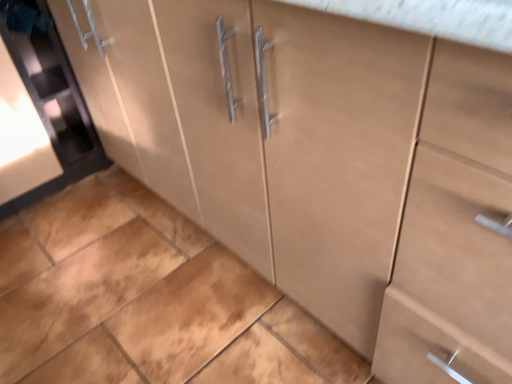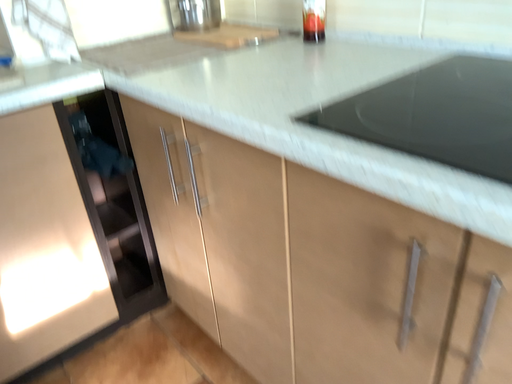
Question: Which way did the camera rotate in the video?

Choices:
 (A) rotated downward
 (B) rotated upward

Answer: (B)